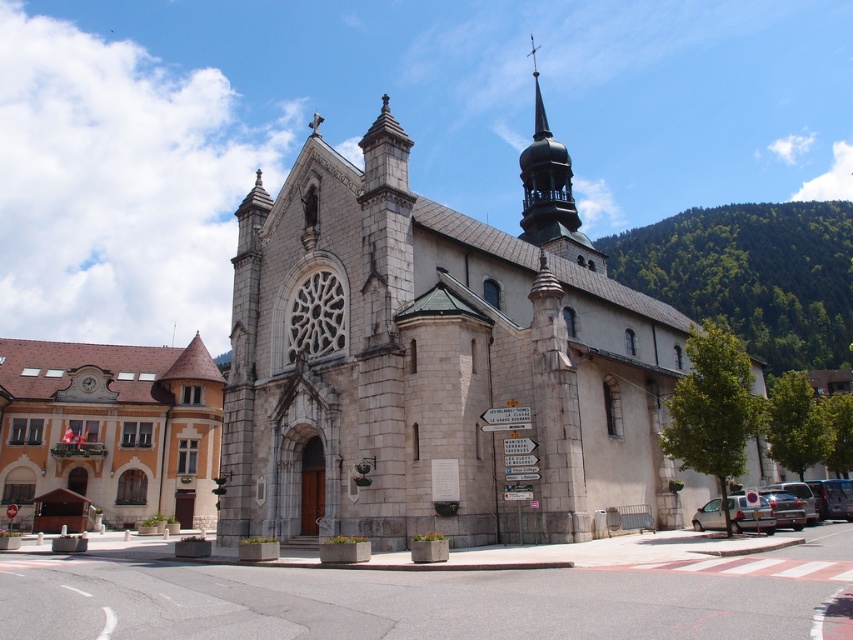
Question: Does silver metallic car at lower right appear on the right side of metallic silver car at lower right?

Choices:
 (A) yes
 (B) no

Answer: (B)

Question: Is matte stone church at center below silver metallic car at lower right?

Choices:
 (A) no
 (B) yes

Answer: (A)

Question: Which of the following is the farthest from the observer?

Choices:
 (A) matte stone church at center
 (B) gold textured spire at upper right

Answer: (B)

Question: Does matte stone church at center appear on the right side of silver metallic car at lower right?

Choices:
 (A) yes
 (B) no

Answer: (B)

Question: Which of these objects is positioned closest to the silver metallic car at lower right?

Choices:
 (A) matte stone church at center
 (B) gold textured spire at upper right
 (C) metallic silver car at lower right
 (D) stone church at center

Answer: (C)

Question: Which object appears closest to the camera in this image?

Choices:
 (A) metallic silver car at lower right
 (B) silver metallic car at lower right
 (C) matte stone church at center

Answer: (B)